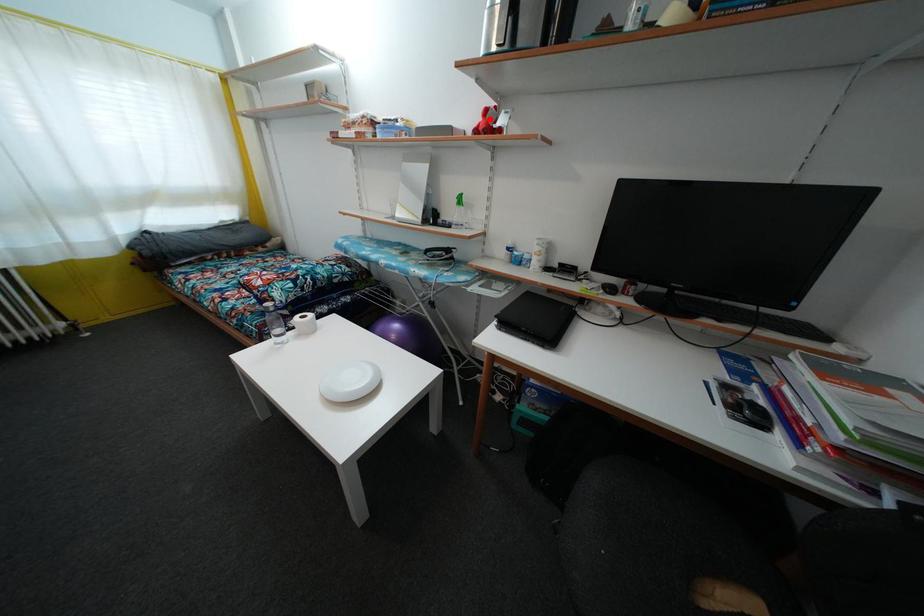
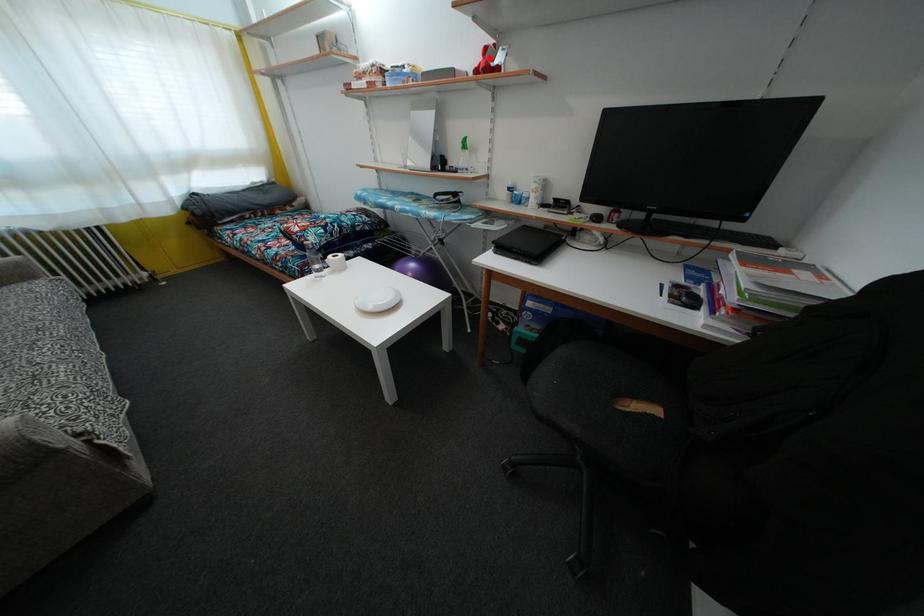
I am providing you with two images of the same scene from different viewpoints. A red point is marked on the first image and another point is marked on the second image. Is the red point in image1 aligned with the point shown in image2?

Yes